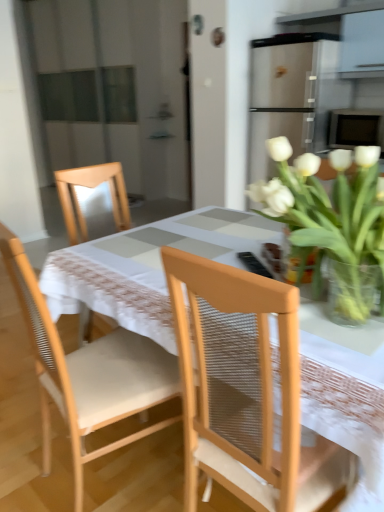
Question: Is white fabric table at center smaller than wooden chair at center, placed as the first chair when sorted from left to right?

Choices:
 (A) yes
 (B) no

Answer: (B)

Question: Considering the relative sizes of white fabric table at center and wooden chair at center, placed as the first chair when sorted from left to right, in the image provided, is white fabric table at center shorter than wooden chair at center, placed as the first chair when sorted from left to right,?

Choices:
 (A) no
 (B) yes

Answer: (B)

Question: Would you say white fabric table at center is a long distance from wooden chair at center, placed as the first chair when sorted from left to right?

Choices:
 (A) yes
 (B) no

Answer: (B)

Question: From a real-world perspective, is white fabric table at center below wooden chair at center, acting as the 2th chair starting from the right?

Choices:
 (A) yes
 (B) no

Answer: (A)

Question: Is white fabric table at center to the left of wooden chair at center, acting as the 2th chair starting from the right, from the viewer's perspective?

Choices:
 (A) yes
 (B) no

Answer: (B)

Question: Based on their sizes in the image, would you say clear glass vase at upper right is bigger or smaller than white fabric table at center?

Choices:
 (A) small
 (B) big

Answer: (A)

Question: Does point (317, 250) appear closer or farther from the camera than point (355, 444)?

Choices:
 (A) farther
 (B) closer

Answer: (A)

Question: Is clear glass vase at upper right situated inside white fabric table at center or outside?

Choices:
 (A) inside
 (B) outside

Answer: (B)

Question: From a real-world perspective, relative to white fabric table at center, is clear glass vase at upper right vertically above or below?

Choices:
 (A) below
 (B) above

Answer: (B)

Question: Considering the positions of wooden chair at center, acting as the 2th chair starting from the right, and clear glass vase at upper right in the image, is wooden chair at center, acting as the 2th chair starting from the right, taller or shorter than clear glass vase at upper right?

Choices:
 (A) tall
 (B) short

Answer: (A)

Question: In the image, is wooden chair at center, placed as the first chair when sorted from left to right, on the left side or the right side of clear glass vase at upper right?

Choices:
 (A) left
 (B) right

Answer: (A)

Question: Is point (188, 439) closer or farther from the camera than point (284, 252)?

Choices:
 (A) closer
 (B) farther

Answer: (A)

Question: From a real-world perspective, is wooden chair at center, placed as the first chair when sorted from left to right, above or below clear glass vase at upper right?

Choices:
 (A) below
 (B) above

Answer: (A)

Question: In the image, is light brown woven chair at center, the first chair from the right, positioned in front of or behind wooden chair at center, acting as the 2th chair starting from the right?

Choices:
 (A) front
 (B) behind

Answer: (A)

Question: In terms of width, does light brown woven chair at center, the 2th chair from the left, look wider or thinner when compared to wooden chair at center, acting as the 2th chair starting from the right?

Choices:
 (A) wide
 (B) thin

Answer: (B)